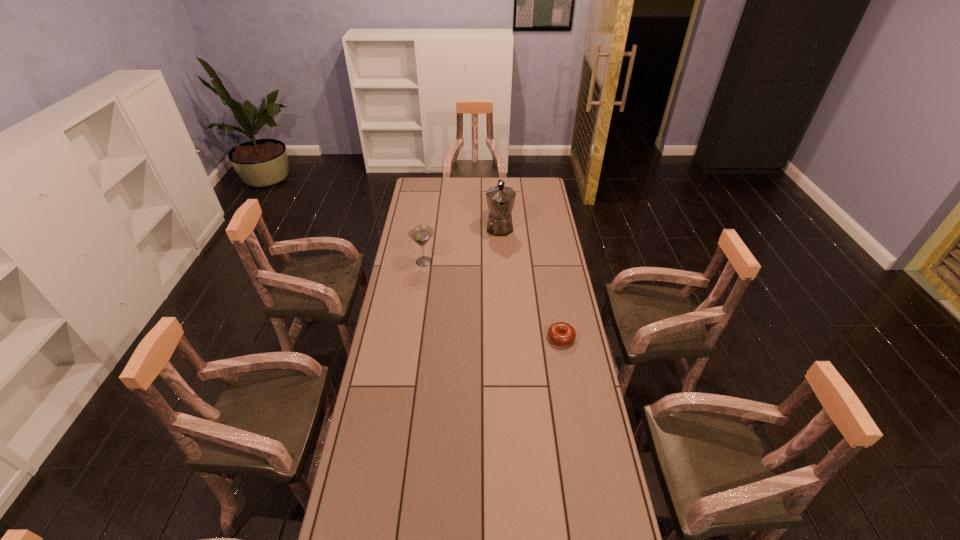
Image resolution: width=960 pixels, height=540 pixels. What are the coordinates of `object that is at the right edge` in the screenshot? It's located at (560, 333).

At what (x,y) coordinates should I click in order to perform the action: click on vacant region at the far edge. Please return your answer as a coordinate pair (x, y). The height and width of the screenshot is (540, 960). Looking at the image, I should click on (482, 189).

What are the coordinates of `vacant space at the left edge of the desktop` in the screenshot? It's located at (403, 287).

This screenshot has width=960, height=540. Find the location of `vacant space at the right edge`. vacant space at the right edge is located at coordinates (544, 337).

The image size is (960, 540). I want to click on vacant space at the far left corner, so click(x=421, y=181).

Identify the location of unoccupied position between the rightmost object and the second tallest object. Image resolution: width=960 pixels, height=540 pixels. (492, 300).

Find the location of `free spot between the shortest object and the second shortest object`. free spot between the shortest object and the second shortest object is located at coordinates (492, 300).

The image size is (960, 540). In order to click on vacant region between the martini and the doughnut in this screenshot , I will do `click(492, 300)`.

Locate an element on the screen. The height and width of the screenshot is (540, 960). empty location between the doughnut and the tallest object is located at coordinates (530, 282).

You are a GUI agent. You are given a task and a screenshot of the screen. Output one action in this format:
    pyautogui.click(x=<x>, y=<y>)
    Task: Click on the object identified as the second closest to the farthest object
    
    Given the screenshot: What is the action you would take?
    pyautogui.click(x=560, y=333)